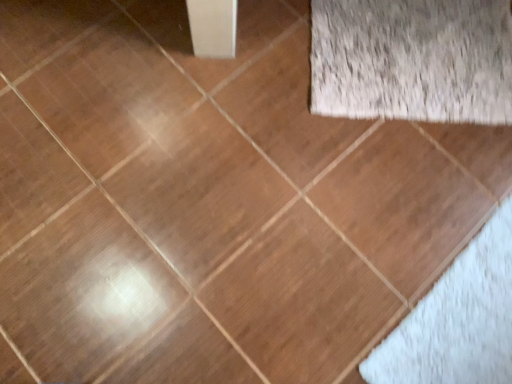
The image size is (512, 384). Find the location of `free spot below white fluffy rug at upper right (from a real-world perspective)`. free spot below white fluffy rug at upper right (from a real-world perspective) is located at coordinates (423, 56).